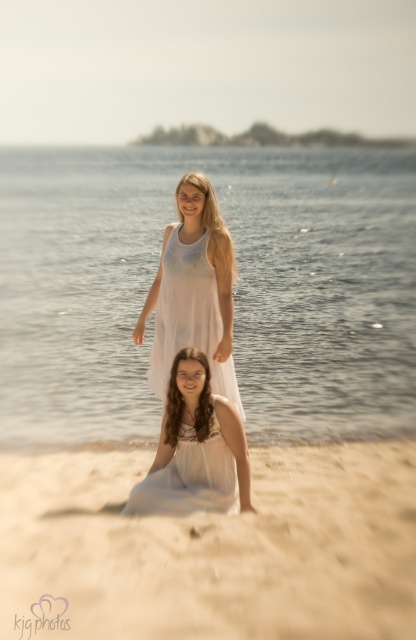
Question: Which point is farther to the camera?

Choices:
 (A) (331, 476)
 (B) (163, 253)
 (C) (218, 512)
 (D) (272, 374)

Answer: (D)

Question: Does clear water at center have a greater width compared to white sheer dress at lower center?

Choices:
 (A) no
 (B) yes

Answer: (B)

Question: Among these points, which one is farthest from the camera?

Choices:
 (A) (190, 307)
 (B) (104, 461)
 (C) (252, 225)
 (D) (165, 472)

Answer: (C)

Question: Can you confirm if clear water at center is wider than beige sandy beach at lower center?

Choices:
 (A) no
 (B) yes

Answer: (B)

Question: Is clear water at center smaller than beige sandy beach at lower center?

Choices:
 (A) yes
 (B) no

Answer: (B)

Question: Among these points, which one is farthest from the camera?

Choices:
 (A) (88, 160)
 (B) (180, 435)
 (C) (220, 556)

Answer: (A)